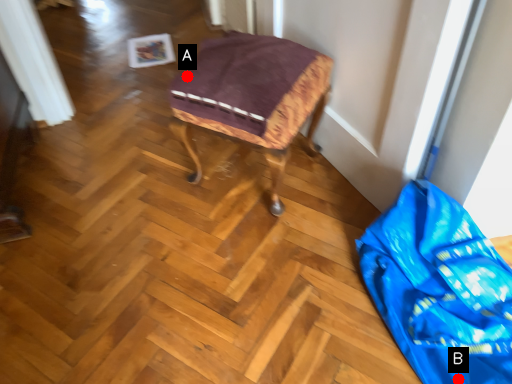
Question: Two points are circled on the image, labeled by A and B beside each circle. Among these points, which one is nearest to the camera?

Choices:
 (A) A is closer
 (B) B is closer

Answer: (B)